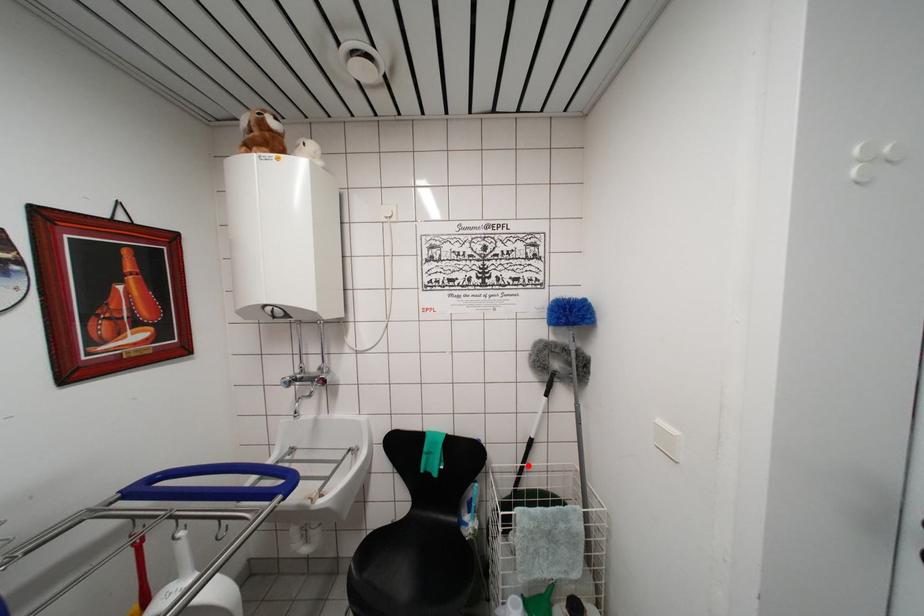
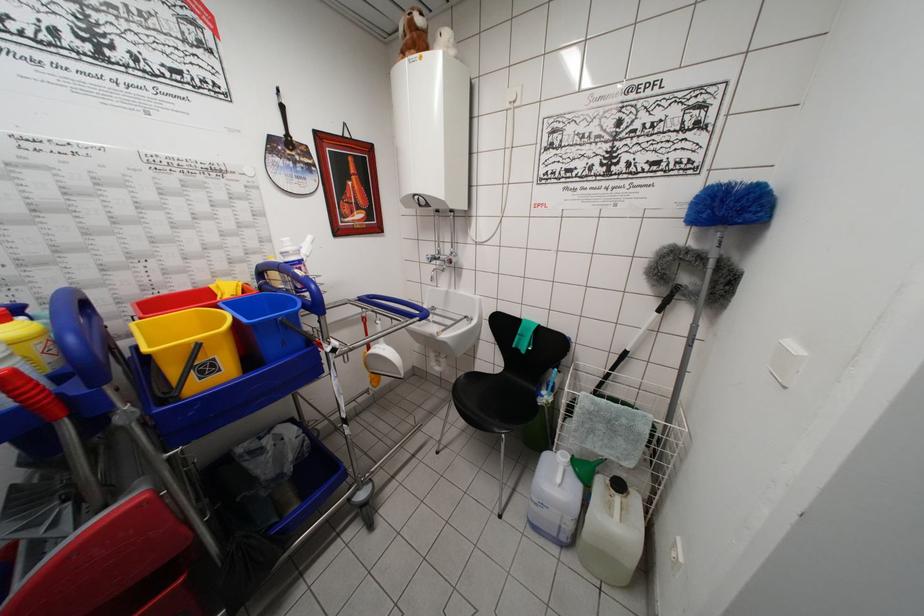
Question: A red point is marked in image1. In image2, is the corresponding 3D point closer to the camera or farther? Reply with the corresponding letter.

Choices:
 (A) The corresponding 3D point is closer.
 (B) The corresponding 3D point is farther.

Answer: (A)